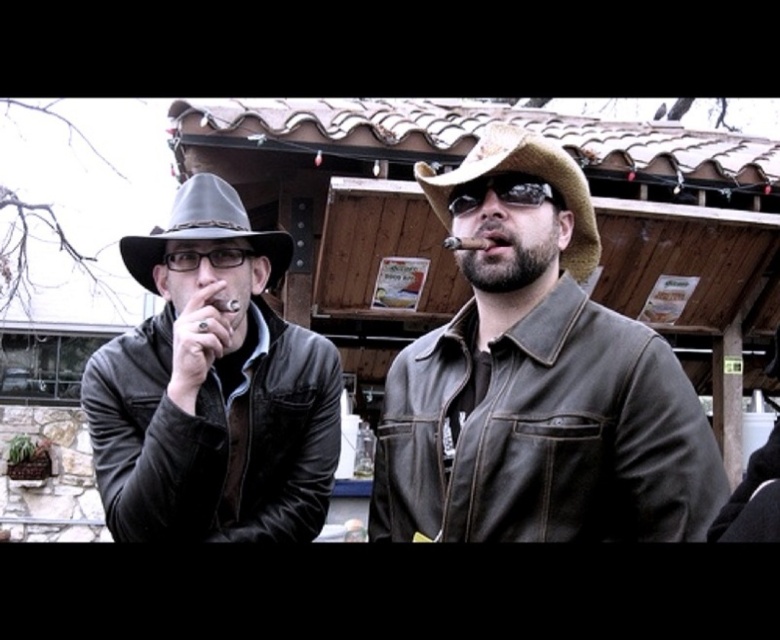
Based on the photo, you are standing in front of the two men in the image. You want to reach the brown leather jacket at center without moving closer than 5 meters from your current position. Is it possible?

The brown leather jacket at center is 7.17 meters from viewer, so yes, you can reach it without moving closer than 5 meters since it is farther away than 5 meters.

You are a photographer trying to capture both the brown leather jacket at center and the brown leather hat at center in a single frame. Since you want to ensure both are clearly visible, which object should you focus on first to account for their size difference?

The brown leather jacket at center is larger than the brown leather hat at center, so you should focus on the brown leather jacket at center first to ensure its details are sharp, as it occupies more space in the frame.